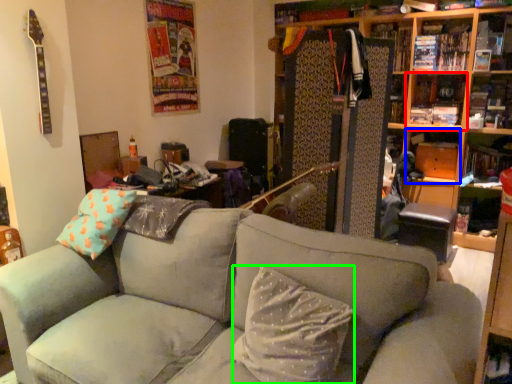
Question: Based on their relative distances, which object is nearer to shelf (highlighted by a red box)? Choose from shelf (highlighted by a blue box) and pillow (highlighted by a green box).

Choices:
 (A) shelf
 (B) pillow

Answer: (A)